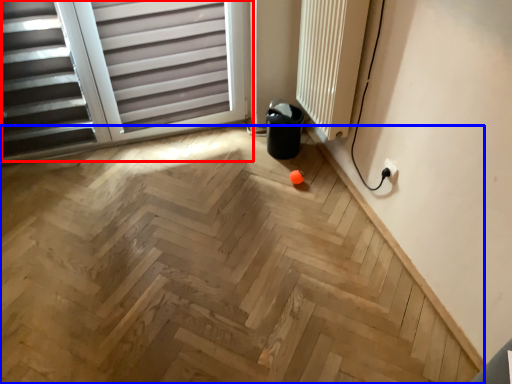
Question: Which of the following is the farthest to the observer, window (highlighted by a red box) or plywood (highlighted by a blue box)?

Choices:
 (A) window
 (B) plywood

Answer: (A)